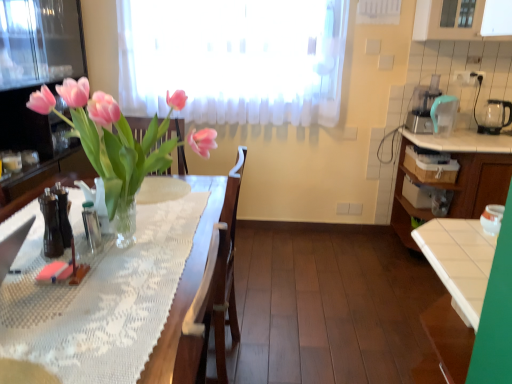
Question: Can you confirm if white glossy jar at right, marked as the first appliance in a front-to-back arrangement, is taller than white glossy cabinet at right?

Choices:
 (A) no
 (B) yes

Answer: (A)

Question: Considering the relative sizes of white glossy jar at right, the first appliance positioned from the left, and white glossy cabinet at right in the image provided, is white glossy jar at right, the first appliance positioned from the left, shorter than white glossy cabinet at right?

Choices:
 (A) no
 (B) yes

Answer: (B)

Question: Does white glossy jar at right, marked as the first appliance in a front-to-back arrangement, appear on the left side of white glossy cabinet at right?

Choices:
 (A) yes
 (B) no

Answer: (A)

Question: From the image's perspective, would you say white glossy jar at right, positioned as the 3th appliance in top-to-bottom order, is positioned over white glossy cabinet at right?

Choices:
 (A) yes
 (B) no

Answer: (B)

Question: Is white glossy jar at right, marked as the first appliance in a front-to-back arrangement, located outside white glossy cabinet at right?

Choices:
 (A) yes
 (B) no

Answer: (A)

Question: Is white glossy jar at right, which appears as the 3th appliance when viewed from the back, behind white glossy cabinet at right?

Choices:
 (A) yes
 (B) no

Answer: (B)

Question: Does white glossy jar at right, which appears as the 3th appliance when viewed from the back, have a larger size compared to transparent glass kettle at right, the 1th appliance positioned from the top?

Choices:
 (A) no
 (B) yes

Answer: (A)

Question: From a real-world perspective, is white glossy jar at right, marked as the first appliance in a front-to-back arrangement, over transparent glass kettle at right, which is the first appliance in back-to-front order?

Choices:
 (A) no
 (B) yes

Answer: (A)

Question: Is white glossy jar at right, which appears as the 3th appliance when viewed from the back, wider than transparent glass kettle at right, marked as the third appliance in a left-to-right arrangement?

Choices:
 (A) no
 (B) yes

Answer: (A)

Question: Is white glossy jar at right, which appears as the 3th appliance when viewed from the back, positioned before transparent glass kettle at right, arranged as the 1th appliance when viewed from the right?

Choices:
 (A) yes
 (B) no

Answer: (A)

Question: Is white glossy jar at right, which is the first appliance from bottom to top, smaller than transparent glass kettle at right, the 3th appliance in the bottom-to-top sequence?

Choices:
 (A) yes
 (B) no

Answer: (A)

Question: Is white glossy jar at right, which ranks as the third appliance in right-to-left order, looking in the opposite direction of transparent glass kettle at right, the 3th appliance when ordered from front to back?

Choices:
 (A) yes
 (B) no

Answer: (B)

Question: Would you say teal plastic blender at upper right, which is the 2th appliance in right-to-left order, is outside white glossy cabinet at right?

Choices:
 (A) yes
 (B) no

Answer: (A)